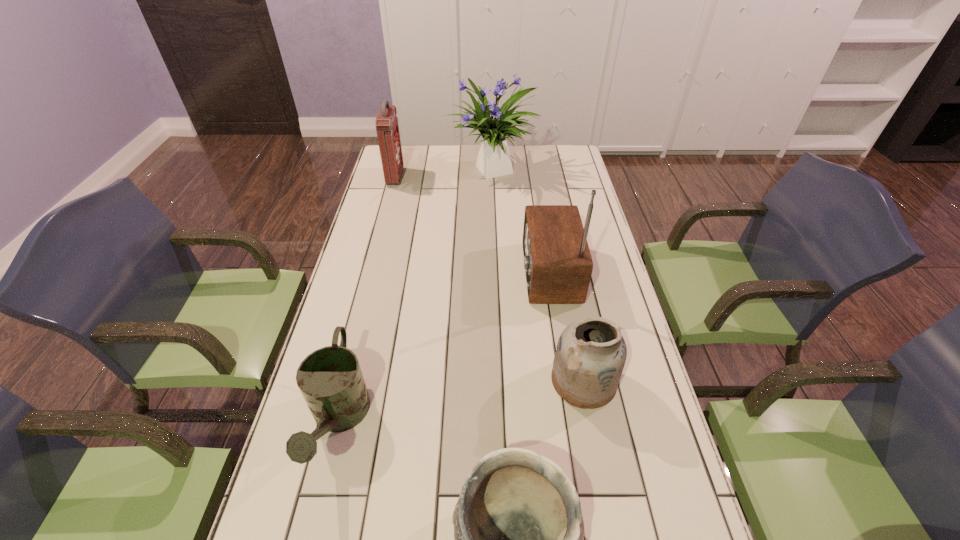
Identify which object is the fifth closest to the flower arrangement. Please provide its 2D coordinates. Your answer should be formatted as a tuple, i.e. [(x, y)], where the tuple contains the x and y coordinates of a point satisfying the conditions above.

[(518, 530)]

Identify the location of free space that satisfies the following two spatial constraints: 1. on the front-facing side of the fourth nearest object; 2. with the spout on the watering can. The width and height of the screenshot is (960, 540). (572, 421).

The height and width of the screenshot is (540, 960). What are the coordinates of `free space that satisfies the following two spatial constraints: 1. on the front-facing side of the fourth nearest object; 2. on the left side of the farther pottery` in the screenshot? It's located at (566, 381).

Find the location of a particular element. This screenshot has height=540, width=960. vacant space that satisfies the following two spatial constraints: 1. on the front-facing side of the radio receiver; 2. on the left side of the farther pottery is located at coordinates (566, 381).

Locate an element on the screen. free point that satisfies the following two spatial constraints: 1. on the front side of the flower arrangement; 2. on the front-facing side of the first-aid kit is located at coordinates (491, 177).